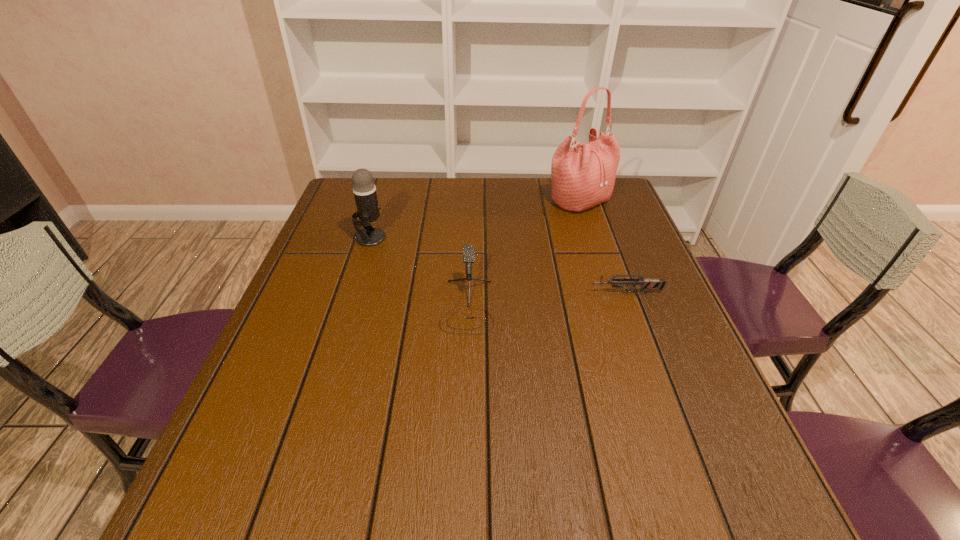
Locate an element on the screen. The width and height of the screenshot is (960, 540). the tallest object is located at coordinates (583, 175).

Locate an element on the screen. the farthest object is located at coordinates (583, 175).

Find the location of a particular element. the third shortest object is located at coordinates (364, 189).

I want to click on the leftmost object, so click(364, 189).

Find the location of a particular element. The image size is (960, 540). the third object from right to left is located at coordinates (468, 252).

Find the location of `the nearer microphone`. the nearer microphone is located at coordinates (468, 252).

This screenshot has width=960, height=540. Find the location of `the shortest object`. the shortest object is located at coordinates click(x=645, y=284).

Find the location of a particular element. free location located 0.100m on the left of the farthest object is located at coordinates click(x=516, y=200).

Image resolution: width=960 pixels, height=540 pixels. Identify the location of vacant area situated 0.370m on the front of the left microphone. (334, 354).

You are a GUI agent. You are given a task and a screenshot of the screen. Output one action in this format:
    pyautogui.click(x=<x>, y=<y>)
    Task: Click on the vacant space located 0.390m on the stand of the third object from right to left
    
    Given the screenshot: What is the action you would take?
    pyautogui.click(x=460, y=526)